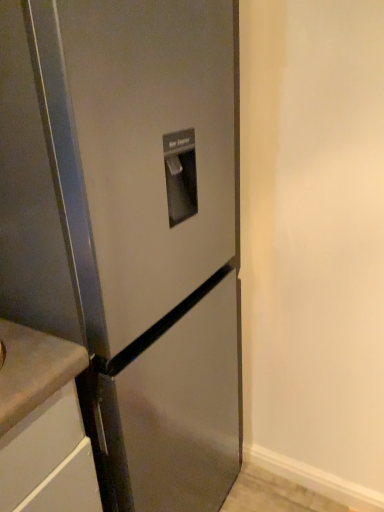
Image resolution: width=384 pixels, height=512 pixels. Find the location of `satin steel refrigerator at center`. satin steel refrigerator at center is located at coordinates (130, 229).

What do you see at coordinates (130, 229) in the screenshot?
I see `satin steel refrigerator at center` at bounding box center [130, 229].

Find the location of a particular element. The height and width of the screenshot is (512, 384). satin steel refrigerator at center is located at coordinates (130, 229).